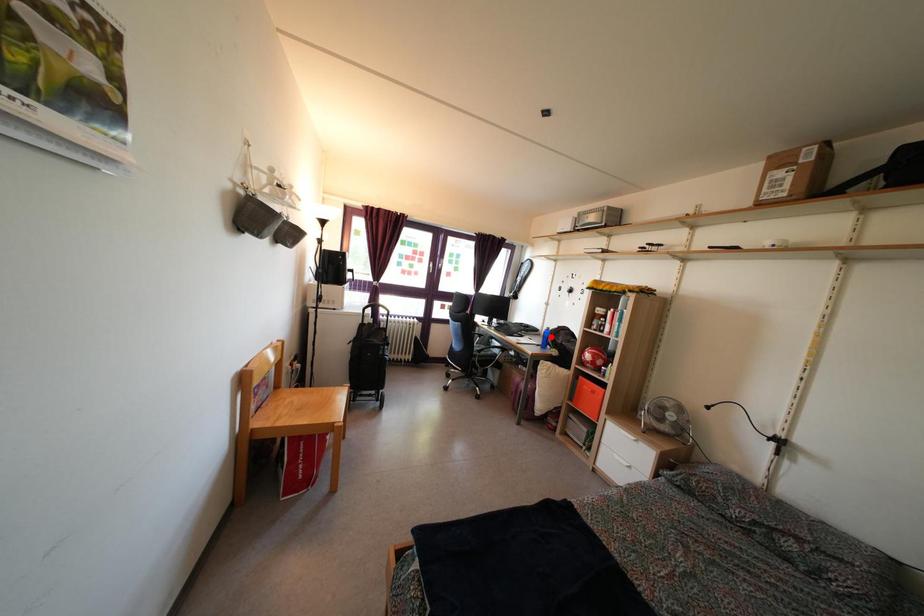
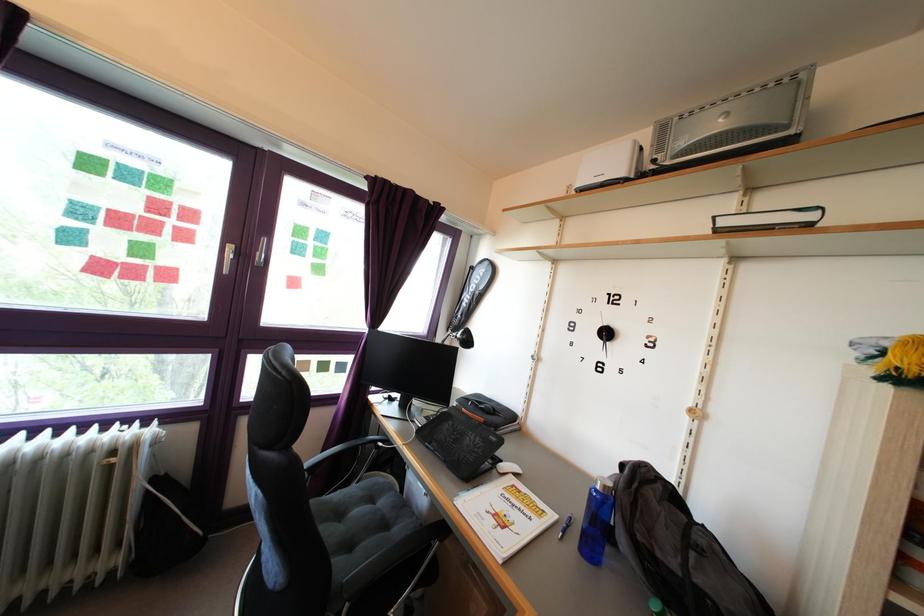
Find the pixel in the second image that matches the highlighted location in the first image.

(609, 496)